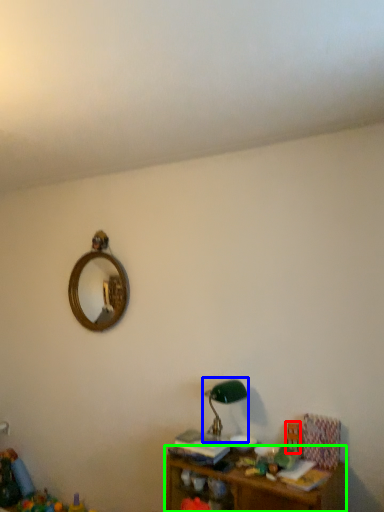
Question: Estimate the real-world distances between objects in this image. Which object is farther from toy (highlighted by a red box), table lamp (highlighted by a blue box) or shelf (highlighted by a green box)?

Choices:
 (A) table lamp
 (B) shelf

Answer: (B)